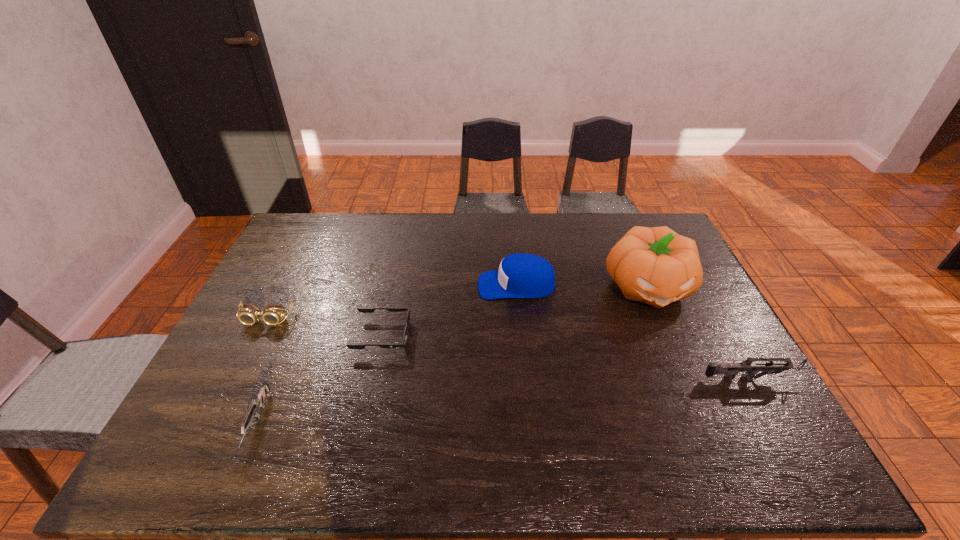
The image size is (960, 540). I want to click on vacant region located on the temples of the fourth object from right to left, so click(x=435, y=336).

Where is `free space located on the front-facing side of the third object from right to left`? free space located on the front-facing side of the third object from right to left is located at coordinates (353, 285).

The height and width of the screenshot is (540, 960). Identify the location of blank space located on the front-facing side of the third object from right to left. (381, 285).

This screenshot has width=960, height=540. In order to click on vacant region located 0.230m on the front-facing side of the third object from right to left in this screenshot , I will do `click(406, 285)`.

Locate an element on the screen. free space located 0.190m on the carved face of the tallest object is located at coordinates (684, 372).

At what (x,y) coordinates should I click in order to perform the action: click on vacant space situated 0.060m through the lenses of the goggles. Please return your answer as a coordinate pair (x, y). Looking at the image, I should click on (253, 344).

Identify the location of object located in the near edge section of the desktop. The image size is (960, 540). (259, 401).

I want to click on object situated at the left edge, so click(x=249, y=314).

Locate an element on the screen. gun positioned at the right edge is located at coordinates (730, 370).

This screenshot has width=960, height=540. I want to click on pumpkin that is at the right edge, so click(657, 266).